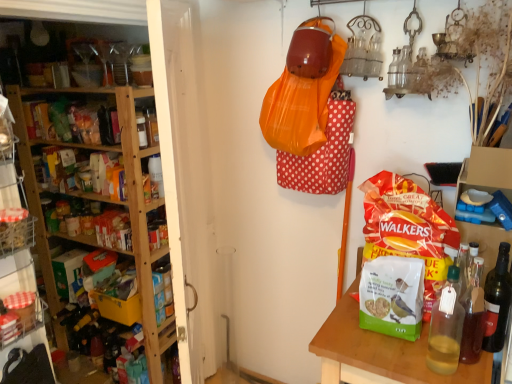
Question: Would you say wooden shelves at left is to the left or to the right of translucent glass bottle at right, which is the second bottle in right-to-left order, in the picture?

Choices:
 (A) right
 (B) left

Answer: (B)

Question: Looking at their shapes, would you say wooden shelves at left is wider or thinner than translucent glass bottle at right, which is the second bottle in right-to-left order?

Choices:
 (A) wide
 (B) thin

Answer: (A)

Question: Based on their relative distances, which object is farther from the translucent glass bottle at right, which is the second bottle in right-to-left order?

Choices:
 (A) wooden table at lower right
 (B) translucent glass bottle at right, which is the second bottle in left-to-right order
 (C) matte red bag of chips at right
 (D) wooden shelves at left

Answer: (D)

Question: Which is farther from the translucent glass bottle at right, which is the second bottle in left-to-right order?

Choices:
 (A) wooden shelves at left
 (B) wooden table at lower right
 (C) translucent glass bottle at right, which is the second bottle in right-to-left order
 (D) matte red bag of chips at right

Answer: (A)